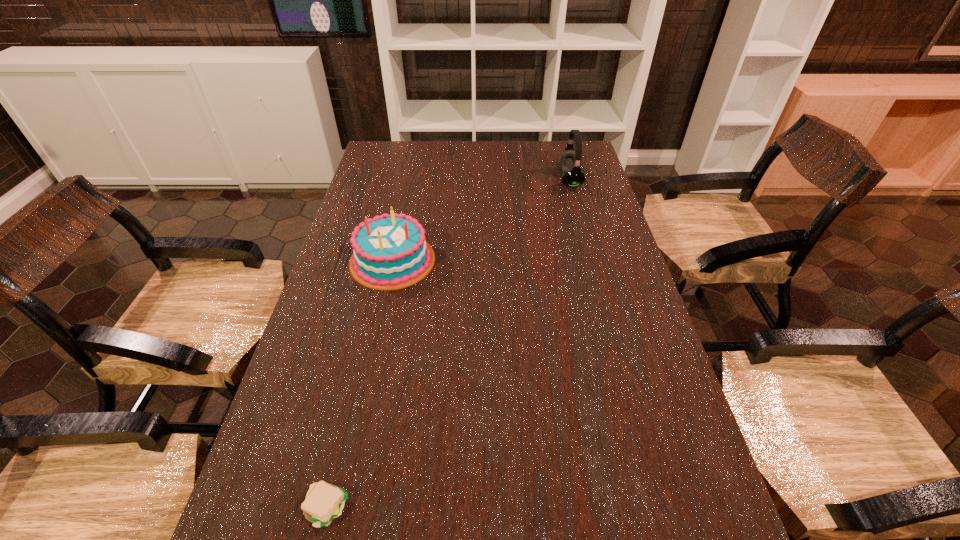
Locate an element on the screen. Image resolution: width=960 pixels, height=540 pixels. vacant region located 0.080m on the right of the patty is located at coordinates (391, 508).

Image resolution: width=960 pixels, height=540 pixels. Identify the location of object that is at the far edge. (569, 161).

Locate an element on the screen. The height and width of the screenshot is (540, 960). birthday cake at the left edge is located at coordinates [389, 252].

The image size is (960, 540). Identify the location of patty that is at the left edge. pos(324,502).

The width and height of the screenshot is (960, 540). I want to click on object at the right edge, so click(x=569, y=161).

This screenshot has height=540, width=960. I want to click on object present at the far right corner, so click(569, 161).

The width and height of the screenshot is (960, 540). In the image, there is a desktop. In order to click on vacant region at the far edge in this screenshot , I will do `click(419, 157)`.

In order to click on blank area at the left edge in this screenshot , I will do `click(372, 191)`.

This screenshot has width=960, height=540. In the image, there is a desktop. In order to click on vacant space at the right edge in this screenshot , I will do (600, 265).

At what (x,y) coordinates should I click in order to perform the action: click on vacant space in between the shortest object and the second nearest object. Please return your answer as a coordinate pair (x, y). Looking at the image, I should click on (360, 384).